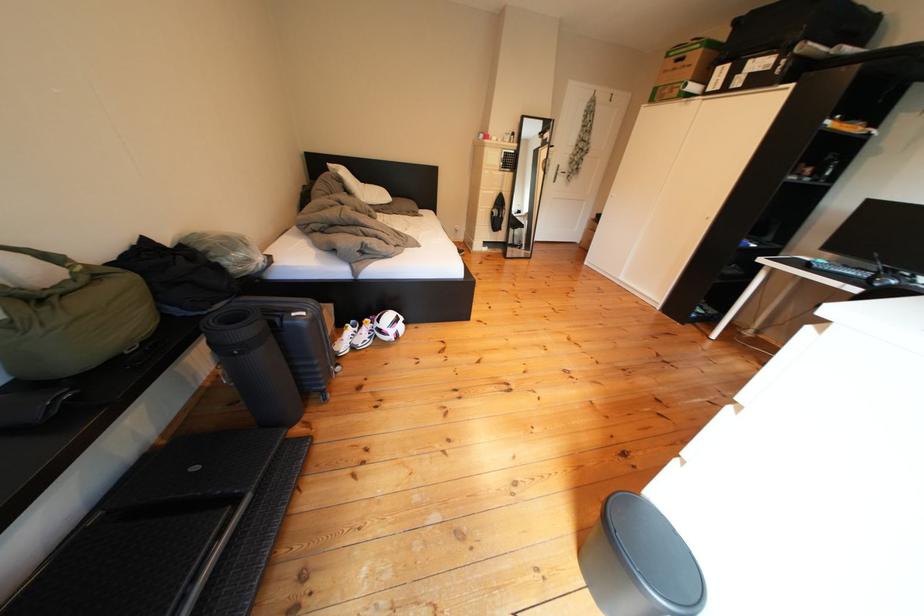
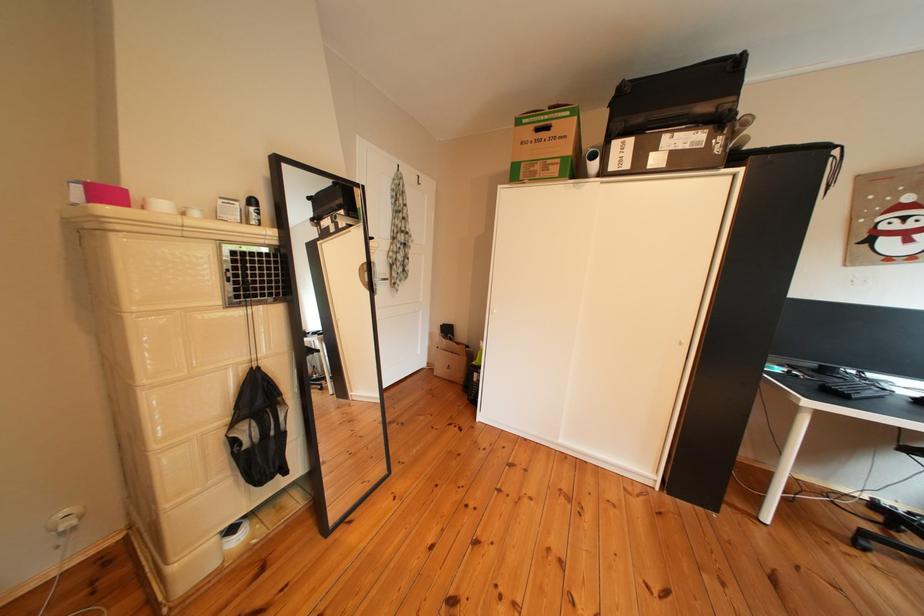
Find the pixel in the second image that matches (x=755, y=90) in the first image.

(676, 169)